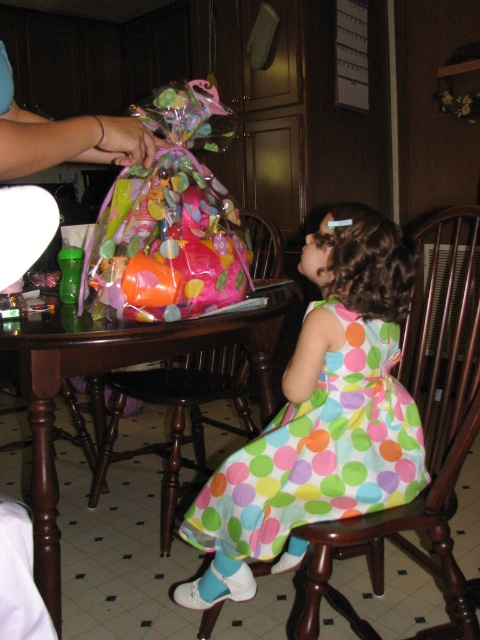
Is dark wood table at center below wooden chair at left?

No.

Between dark wood table at center and wooden chair at left, which one is positioned lower?

Positioned lower is wooden chair at left.

Is point (39, 568) positioned before point (157, 390)?

Yes, it is in front of point (157, 390).

At what (x,y) coordinates should I click in order to perform the action: click on dark wood table at center. Please return your answer as a coordinate pair (x, y). The image size is (480, 640). Looking at the image, I should click on (100, 385).

Between multicolored polka dot dress at lower center and wooden chair at left, which one is positioned higher?

Positioned higher is multicolored polka dot dress at lower center.

Who is positioned more to the right, multicolored polka dot dress at lower center or wooden chair at left?

From the viewer's perspective, multicolored polka dot dress at lower center appears more on the right side.

Does point (362, 353) come in front of point (167, 500)?

That is True.

Identify the location of multicolored polka dot dress at lower center. (319, 451).

Is wooden chair at right further to camera compared to wooden chair at left?

No.

Is wooden chair at right to the right of wooden chair at left from the viewer's perspective?

Yes, wooden chair at right is to the right of wooden chair at left.

Who is more distant from viewer, (475,320) or (236,371)?

Positioned behind is point (236,371).

The image size is (480, 640). What are the coordinates of `wooden chair at right` in the screenshot? It's located at (424, 440).